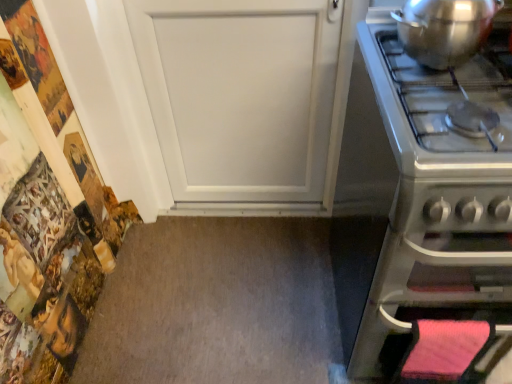
Describe the element at coordinates (444, 29) in the screenshot. I see `shiny metallic pot at upper right` at that location.

The width and height of the screenshot is (512, 384). I want to click on shiny metallic pot at upper right, so click(444, 29).

The height and width of the screenshot is (384, 512). What do you see at coordinates (438, 197) in the screenshot?
I see `satin silver oven at right` at bounding box center [438, 197].

This screenshot has width=512, height=384. I want to click on satin silver oven at right, so click(x=438, y=197).

Where is `shiny metallic pot at upper right`? The height and width of the screenshot is (384, 512). shiny metallic pot at upper right is located at coordinates (444, 29).

Based on the photo, considering the relative positions of satin silver oven at right and shiny metallic pot at upper right in the image provided, is satin silver oven at right to the left of shiny metallic pot at upper right from the viewer's perspective?

Incorrect, satin silver oven at right is not on the left side of shiny metallic pot at upper right.

In the scene shown: Considering their positions, is satin silver oven at right located in front of or behind shiny metallic pot at upper right?

satin silver oven at right is in front of shiny metallic pot at upper right.

Does point (422, 261) appear closer or farther from the camera than point (402, 37)?

Clearly, point (422, 261) is closer to the camera than point (402, 37).

From the image's perspective, is satin silver oven at right located above or below shiny metallic pot at upper right?

Based on their image positions, satin silver oven at right is located beneath shiny metallic pot at upper right.

From a real-world perspective, is satin silver oven at right above or below shiny metallic pot at upper right?

From a real-world perspective, satin silver oven at right is physically below shiny metallic pot at upper right.

Is satin silver oven at right wider or thinner than shiny metallic pot at upper right?

In the image, satin silver oven at right appears to be wider than shiny metallic pot at upper right.

Considering the sizes of objects satin silver oven at right and shiny metallic pot at upper right in the image provided, who is taller, satin silver oven at right or shiny metallic pot at upper right?

satin silver oven at right.

Looking at this image, in terms of size, does satin silver oven at right appear bigger or smaller than shiny metallic pot at upper right?

Clearly, satin silver oven at right is larger in size than shiny metallic pot at upper right.

Do you think satin silver oven at right is within shiny metallic pot at upper right, or outside of it?

satin silver oven at right cannot be found inside shiny metallic pot at upper right.

Would you consider satin silver oven at right to be distant from shiny metallic pot at upper right?

That's not correct — satin silver oven at right is a little close to shiny metallic pot at upper right.

Is satin silver oven at right oriented towards shiny metallic pot at upper right?

No, satin silver oven at right is not oriented towards shiny metallic pot at upper right.

Can you tell me how much satin silver oven at right and shiny metallic pot at upper right differ in facing direction?

There is a 0.233-degree angle between the facing directions of satin silver oven at right and shiny metallic pot at upper right.

Identify the location of oven below the shiny metallic pot at upper right (from a real-world perspective). This screenshot has width=512, height=384. (438, 197).

Is shiny metallic pot at upper right at the left side of satin silver oven at right?

Indeed, shiny metallic pot at upper right is positioned on the left side of satin silver oven at right.

Looking at this image, does shiny metallic pot at upper right lie behind satin silver oven at right?

Yes, shiny metallic pot at upper right is further from the camera.

Is point (422, 39) closer to viewer compared to point (495, 254)?

No.

From the image's perspective, is shiny metallic pot at upper right above satin silver oven at right?

Indeed, from the image's perspective, shiny metallic pot at upper right is shown above satin silver oven at right.

From a real-world perspective, is shiny metallic pot at upper right positioned above or below satin silver oven at right?

In terms of real-world spatial position, shiny metallic pot at upper right is above satin silver oven at right.

Between shiny metallic pot at upper right and satin silver oven at right, which one has larger width?

satin silver oven at right.

Who is taller, shiny metallic pot at upper right or satin silver oven at right?

Standing taller between the two is satin silver oven at right.

Is shiny metallic pot at upper right bigger than satin silver oven at right?

Actually, shiny metallic pot at upper right might be smaller than satin silver oven at right.

Is shiny metallic pot at upper right completely or partially outside of satin silver oven at right?

That's correct, shiny metallic pot at upper right is outside of satin silver oven at right.

Is shiny metallic pot at upper right placed right next to satin silver oven at right?

No.

Is shiny metallic pot at upper right aimed at satin silver oven at right?

No, shiny metallic pot at upper right is not facing towards satin silver oven at right.

Locate an element on the screen. oven in front of the shiny metallic pot at upper right is located at coordinates (438, 197).

The height and width of the screenshot is (384, 512). I want to click on kitchen appliance behind the satin silver oven at right, so click(444, 29).

Image resolution: width=512 pixels, height=384 pixels. I want to click on kitchen appliance above the satin silver oven at right (from the image's perspective), so click(x=444, y=29).